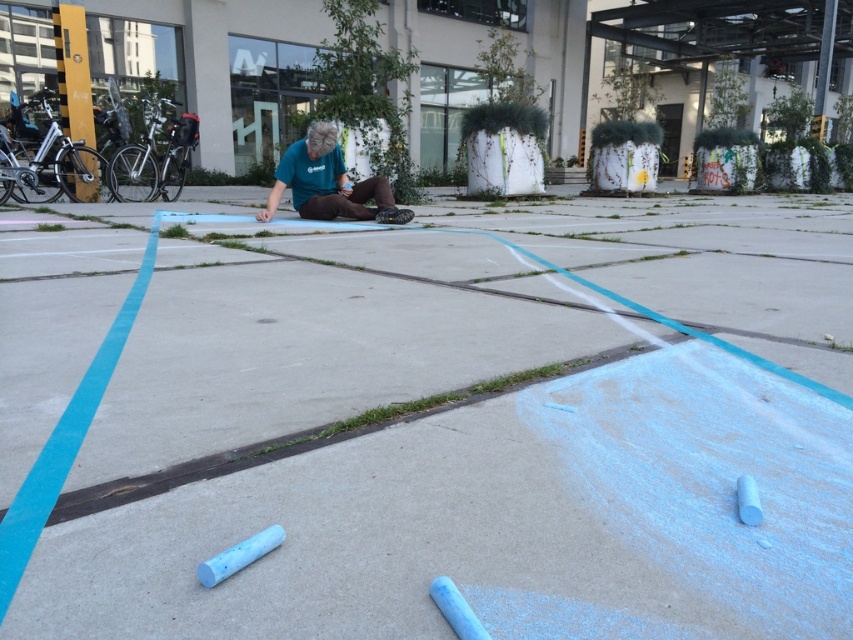
Measure the distance between smooth concrete pavement at center and teal fabric shirt at center.

smooth concrete pavement at center and teal fabric shirt at center are 9.63 feet apart.

Between smooth concrete pavement at center and teal fabric shirt at center, which one has less height?

With less height is teal fabric shirt at center.

Which is behind, point (608, 518) or point (335, 161)?

The point (335, 161) is more distant.

Locate an element on the screen. The height and width of the screenshot is (640, 853). smooth concrete pavement at center is located at coordinates (434, 420).